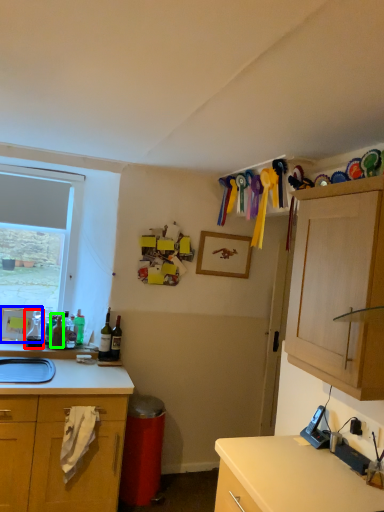
Question: Estimate the real-world distances between objects in this image. Which object is farther from bottle (highlighted by a red box), picture frame (highlighted by a blue box) or bottle (highlighted by a green box)?

Choices:
 (A) picture frame
 (B) bottle

Answer: (B)